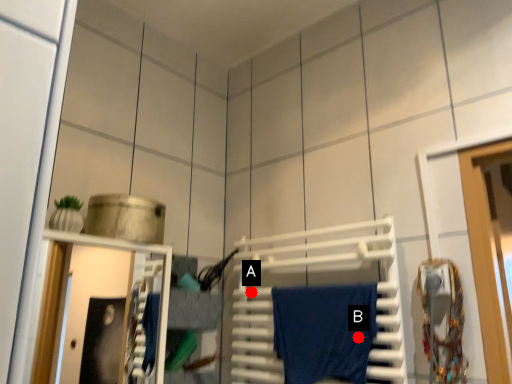
Question: Two points are circled on the image, labeled by A and B beside each circle. Among these points, which one is nearest to the camera?

Choices:
 (A) A is closer
 (B) B is closer

Answer: (B)